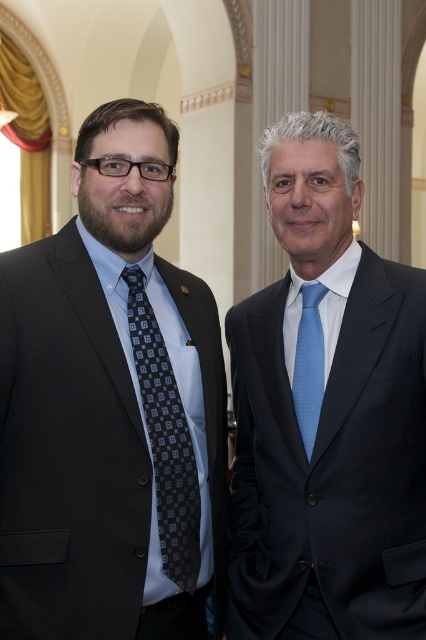
Question: Is matte black suit at left wider than matte black suit at center?

Choices:
 (A) yes
 (B) no

Answer: (A)

Question: Among these points, which one is farthest from the camera?

Choices:
 (A) (157, 404)
 (B) (296, 337)
 (C) (354, 592)

Answer: (B)

Question: Estimate the real-world distances between objects in this image. Which object is farther from the matte black suit at left?

Choices:
 (A) matte black suit at center
 (B) light blue textured tie at center
 (C) dark gray textured tie at left

Answer: (B)

Question: Can you confirm if matte black suit at center is positioned below light blue textured tie at center?

Choices:
 (A) yes
 (B) no

Answer: (B)

Question: Is matte black suit at left positioned in front of matte black suit at center?

Choices:
 (A) yes
 (B) no

Answer: (A)

Question: Among these objects, which one is farthest from the camera?

Choices:
 (A) light blue textured tie at center
 (B) matte black suit at center
 (C) matte black suit at left
 (D) dark gray textured tie at left

Answer: (A)